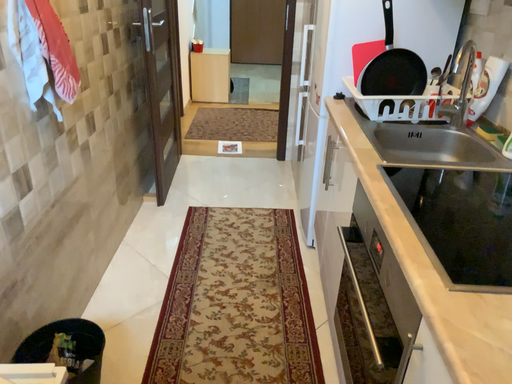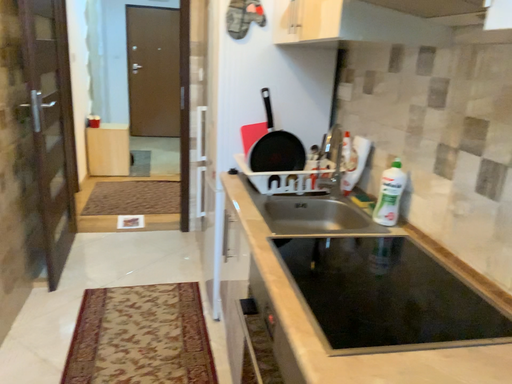
Question: How did the camera likely rotate when shooting the video?

Choices:
 (A) rotated upward
 (B) rotated downward

Answer: (A)